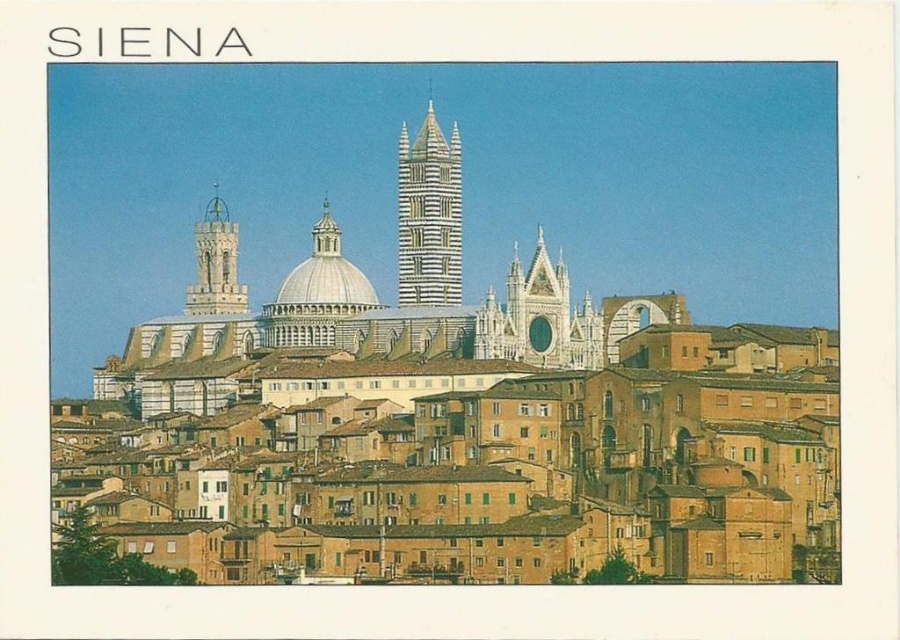
Who is more forward, (399,140) or (310,300)?

Point (310,300)

Is point (451, 214) in front of point (338, 284)?

That is False.

This screenshot has width=900, height=640. I want to click on white striped tower at center, so (x=429, y=216).

Locate an element on the screen. The height and width of the screenshot is (640, 900). white striped tower at center is located at coordinates (429, 216).

Does point (361, 280) lie behind point (221, 300)?

No, (361, 280) is in front of (221, 300).

Between point (316, 264) and point (214, 264), which one is positioned behind?

Point (214, 264)

Which is behind, point (353, 288) or point (235, 269)?

Point (235, 269)

Image resolution: width=900 pixels, height=640 pixels. I want to click on white marble dome at center, so click(324, 280).

Is point (403, 188) positioned behind point (216, 260)?

No.

Does point (452, 131) come in front of point (237, 282)?

No.

At what (x,y) coordinates should I click in order to perform the action: click on white striped tower at center. Please return your answer as a coordinate pair (x, y). Image resolution: width=900 pixels, height=640 pixels. Looking at the image, I should click on tap(429, 216).